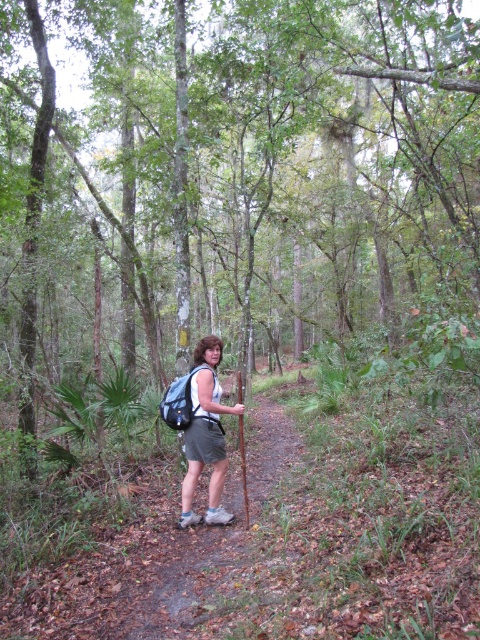
Looking at this image, you are a hiker who just arrived at the forest and see the gray fabric backpack at center and the matte gray backpack at center. Which backpack is positioned to the right?

The gray fabric backpack at center is positioned to the right of the matte gray backpack at center.

You are a hiker who wants to ensure your clothing and gear are appropriately sized for the forest terrain. Given the scene, can you determine if the matte gray shorts at center are narrower than the matte gray backpack at center?

The matte gray shorts at center is less wide than the matte gray backpack at center according to the description, so yes, the shorts are narrower than the backpack.